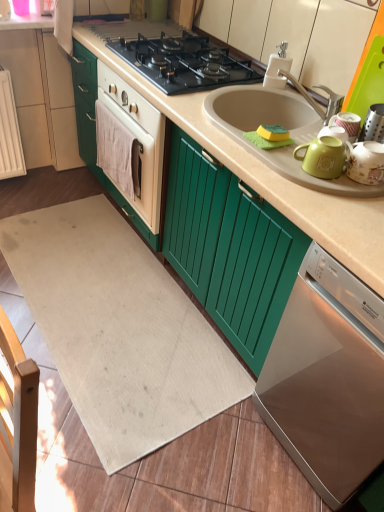
Find the location of a particular element. vacant space to the left of satin silver dishwasher at lower right is located at coordinates (228, 439).